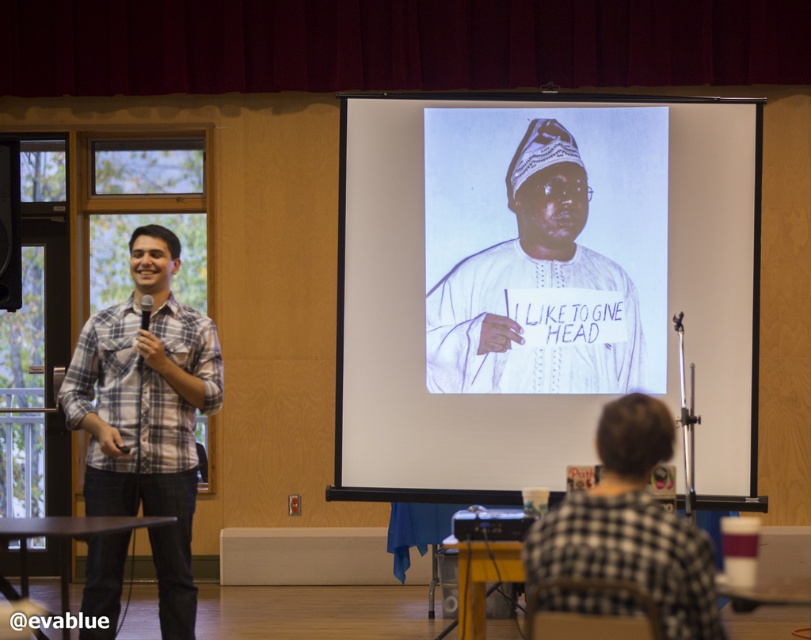
You are an event organizer standing at the center of the room. You need to adjust the microphone stand that is currently near the plaid shirt at left. Which direction should you move to reach the microphone stand?

The plaid shirt at left is located at point 0.647 on the x and 0.182 on the y axis. Since you are at the center, you should move towards the left to reach the microphone stand near the plaid shirt at left.

From the picture: You are an event organizer who needs to adjust the seating arrangement. You notice the white matte clothing at center and the black checkered shirt at lower right. Which of these two items is closer to the front of the room?

The white matte clothing at center is closer to the front of the room because it is further to the viewer than the black checkered shirt at lower right, indicating it is positioned nearer to the front.

What is located at the coordinates point (539, 285) in the image?

The white paper at center is located at point (539, 285).